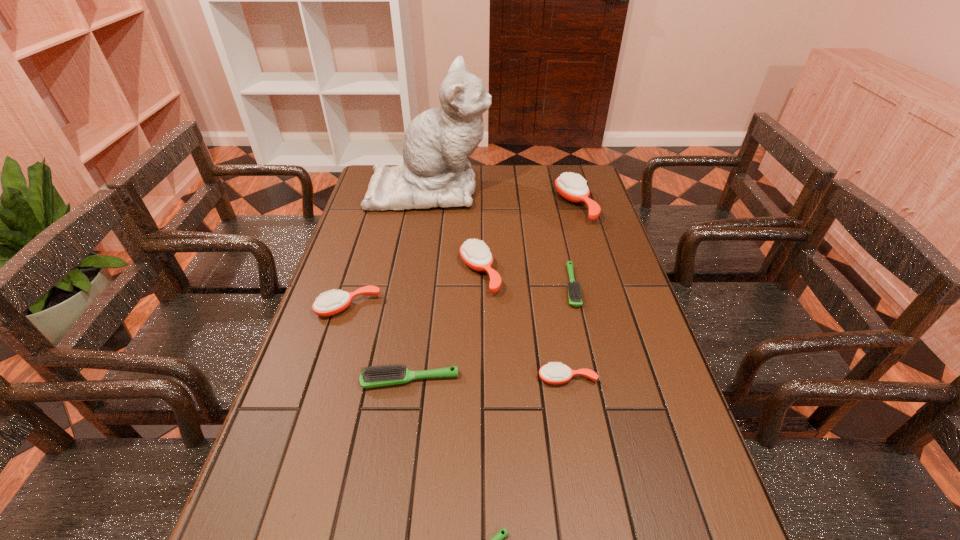
I want to click on hairbrush situated at the far edge, so click(x=571, y=186).

Where is `cat located at the left edge`? The height and width of the screenshot is (540, 960). cat located at the left edge is located at coordinates (435, 172).

Where is `hairbrush located in the left edge section of the desktop`? The image size is (960, 540). hairbrush located in the left edge section of the desktop is located at coordinates (329, 304).

This screenshot has width=960, height=540. In order to click on object that is at the far left corner in this screenshot , I will do `click(435, 172)`.

I want to click on object located in the far right corner section of the desktop, so [x=571, y=186].

Where is `blank area at the far edge`? This screenshot has height=540, width=960. blank area at the far edge is located at coordinates (539, 174).

This screenshot has height=540, width=960. I want to click on vacant region at the left edge of the desktop, so click(375, 300).

Locate an element on the screen. free location at the right edge of the desktop is located at coordinates (617, 272).

You are a GUI agent. You are given a task and a screenshot of the screen. Output one action in this format:
    pyautogui.click(x=<x>, y=<y>)
    Task: Click on the free space at the far right corner
    Image resolution: width=960 pixels, height=540 pixels.
    Given the screenshot: What is the action you would take?
    pyautogui.click(x=552, y=182)

The width and height of the screenshot is (960, 540). Find the location of `vacant point located between the biggest light hairbrush and the sixth shortest object`. vacant point located between the biggest light hairbrush and the sixth shortest object is located at coordinates (444, 327).